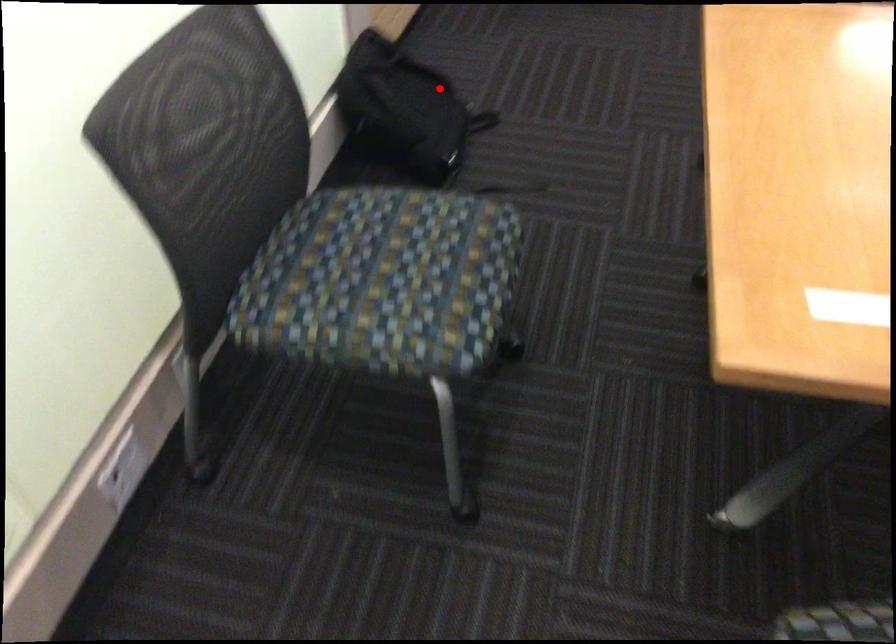
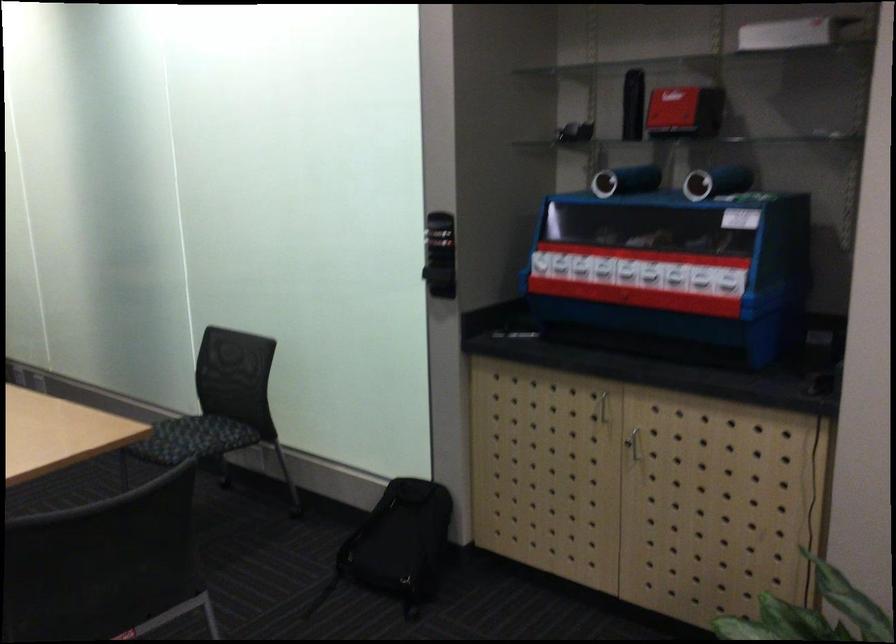
In the second image, find the point that corresponds to the highlighted location in the first image.

(398, 545)